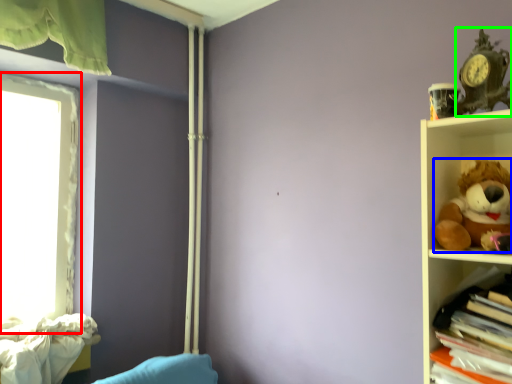
Question: Which object is positioned farthest from window (highlighted by a red box)? Select from toy (highlighted by a blue box) and toy (highlighted by a green box).

Choices:
 (A) toy
 (B) toy

Answer: (B)